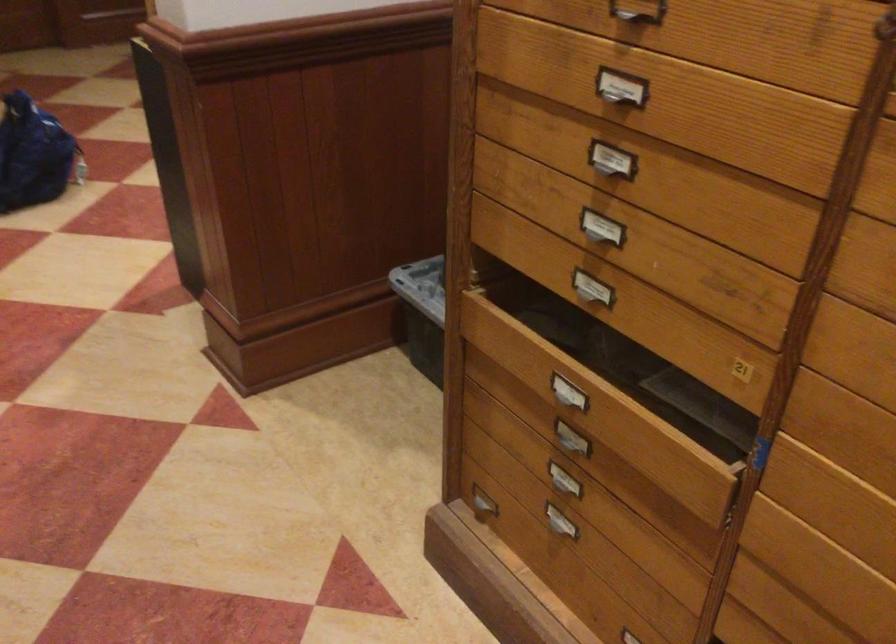
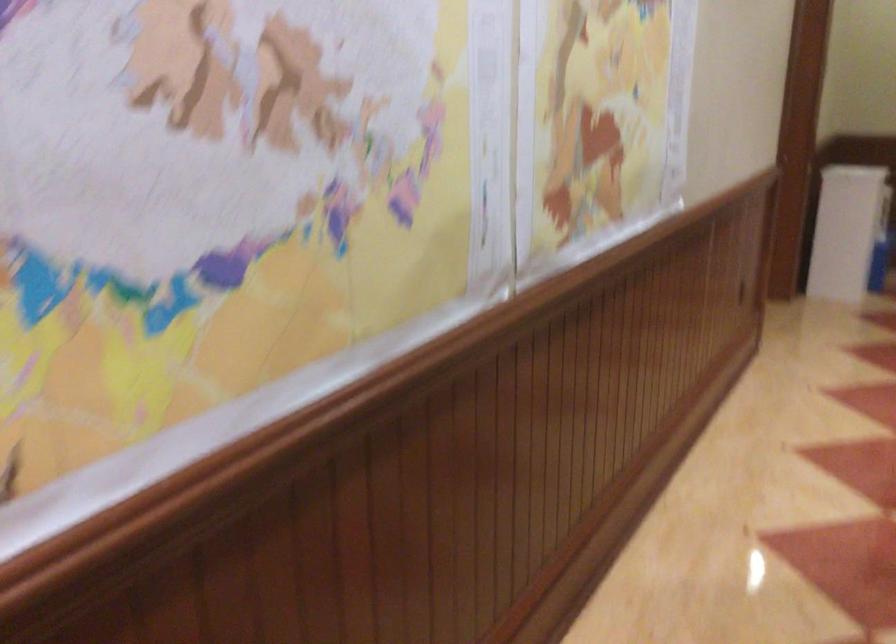
Question: How did the camera likely rotate?

Choices:
 (A) Left
 (B) Right
 (C) Up
 (D) Down

Answer: (A)